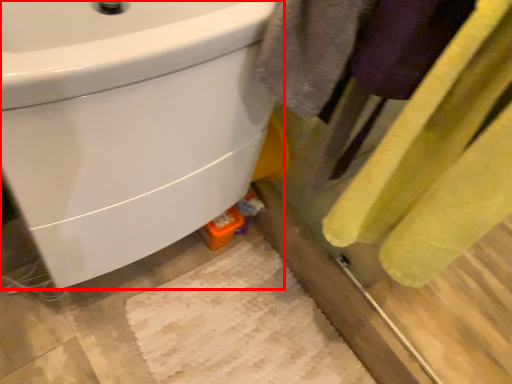
Question: From the image's perspective, what is the correct spatial positioning of sink (annotated by the red box) in reference to bath towel?

Choices:
 (A) above
 (B) below

Answer: (A)